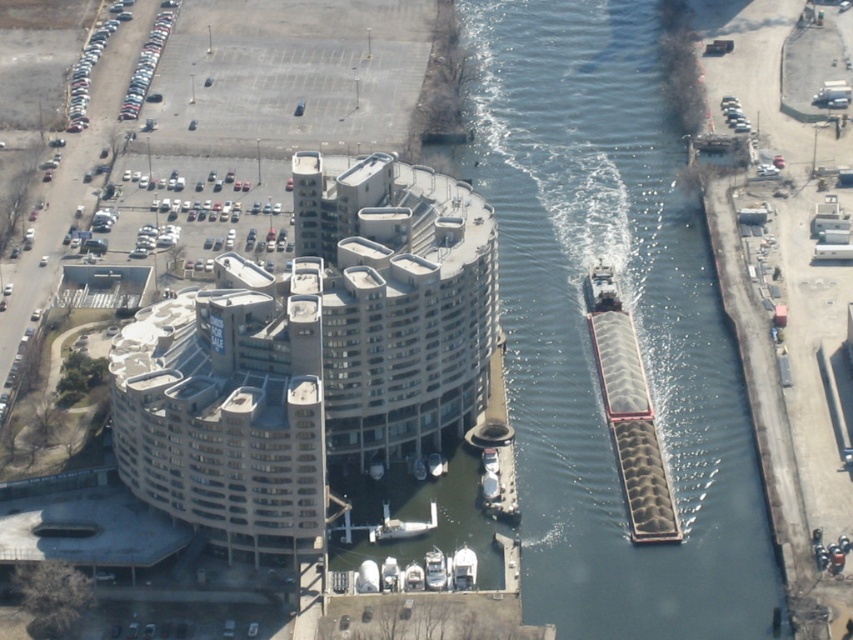
Question: Which of the following is the farthest from the observer?

Choices:
 (A) (641, 122)
 (B) (618, 332)
 (C) (384, 518)
 (D) (608, 291)

Answer: (A)

Question: Does smooth concrete waterway at center appear under metallic gray barge at center-right?

Choices:
 (A) no
 (B) yes

Answer: (A)

Question: Which point appears closest to the camera in this image?

Choices:
 (A) (677, 618)
 (B) (631, 468)
 (C) (613, 278)

Answer: (A)

Question: Is gray metallic barge at right closer to the viewer compared to white matte boat at lower center?

Choices:
 (A) yes
 (B) no

Answer: (B)

Question: Which object is positioned farthest from the metallic gray barge at center-right?

Choices:
 (A) white matte boat at lower center
 (B) smooth concrete waterway at center
 (C) gray metallic barge at right

Answer: (A)

Question: Can you confirm if smooth concrete waterway at center is positioned above metallic gray barge at center-right?

Choices:
 (A) no
 (B) yes

Answer: (B)